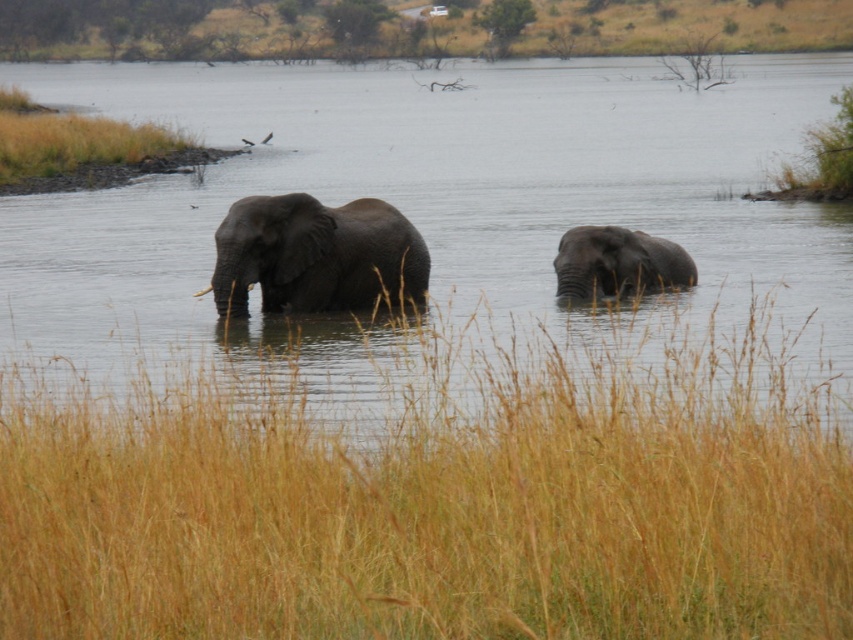
Question: Which point is farther to the camera?

Choices:
 (A) gray matte elephant at center
 (B) brown dry grass at left
 (C) gray matte water at center

Answer: (B)

Question: Can you confirm if gray matte water at center is smaller than gray matte elephant at right?

Choices:
 (A) no
 (B) yes

Answer: (A)

Question: Which point is closer to the camera?

Choices:
 (A) gray matte elephant at right
 (B) gray matte water at center
 (C) brown dry grass at left

Answer: (B)

Question: From the image, what is the correct spatial relationship of gray matte water at center in relation to brown dry grass at left?

Choices:
 (A) above
 (B) below

Answer: (A)

Question: Is brown dry grass at center smaller than gray matte elephant at right?

Choices:
 (A) yes
 (B) no

Answer: (B)

Question: Estimate the real-world distances between objects in this image. Which object is closer to the brown dry grass at left?

Choices:
 (A) gray matte elephant at right
 (B) gray matte water at center
 (C) gray matte elephant at center

Answer: (B)